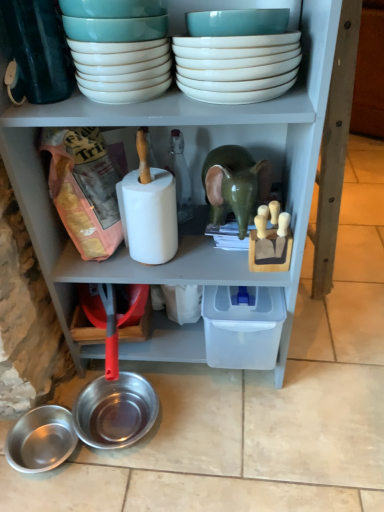
Question: Are shiny metallic bowl at lower left, arranged as the first bowl when ordered from the bottom, and white glossy bowls at upper center, the 2th bowl viewed from the top, making contact?

Choices:
 (A) no
 (B) yes

Answer: (A)

Question: Can you confirm if shiny metallic bowl at lower left, arranged as the first bowl when ordered from the bottom, is positioned to the right of white glossy bowls at upper center, the 2th bowl viewed from the top?

Choices:
 (A) no
 (B) yes

Answer: (A)

Question: From a real-world perspective, is shiny metallic bowl at lower left, arranged as the first bowl when ordered from the bottom, below white glossy bowls at upper center, the 2th bowl viewed from the top?

Choices:
 (A) yes
 (B) no

Answer: (A)

Question: Is shiny metallic bowl at lower left, arranged as the first bowl when ordered from the bottom, located outside white glossy bowls at upper center, placed as the 3th bowl when sorted from bottom to top?

Choices:
 (A) no
 (B) yes

Answer: (B)

Question: Does shiny metallic bowl at lower left, arranged as the first bowl when ordered from the bottom, lie in front of white glossy bowls at upper center, placed as the 3th bowl when sorted from bottom to top?

Choices:
 (A) yes
 (B) no

Answer: (B)

Question: Considering the positions of white glossy bowls at upper center, placed as the 3th bowl when sorted from bottom to top, and shiny metallic bowl at lower left, which ranks as the second bowl in bottom-to-top order, in the image, is white glossy bowls at upper center, placed as the 3th bowl when sorted from bottom to top, taller or shorter than shiny metallic bowl at lower left, which ranks as the second bowl in bottom-to-top order,?

Choices:
 (A) tall
 (B) short

Answer: (A)

Question: Considering the relative positions of white glossy bowls at upper center, the 2th bowl viewed from the top, and shiny metallic bowl at lower left, acting as the third bowl starting from the top, in the image provided, is white glossy bowls at upper center, the 2th bowl viewed from the top, to the left or to the right of shiny metallic bowl at lower left, acting as the third bowl starting from the top,?

Choices:
 (A) right
 (B) left

Answer: (A)

Question: Is white glossy bowls at upper center, placed as the 3th bowl when sorted from bottom to top, bigger or smaller than shiny metallic bowl at lower left, which ranks as the second bowl in bottom-to-top order?

Choices:
 (A) small
 (B) big

Answer: (A)

Question: Considering the positions of white glossy bowls at upper center, the 2th bowl viewed from the top, and shiny metallic bowl at lower left, which ranks as the second bowl in bottom-to-top order, in the image, is white glossy bowls at upper center, the 2th bowl viewed from the top, wider or thinner than shiny metallic bowl at lower left, which ranks as the second bowl in bottom-to-top order,?

Choices:
 (A) wide
 (B) thin

Answer: (B)

Question: Would you say white glossy bowls at upper center, which is counted as the 1th bowl, starting from the top, is to the left or to the right of shiny metallic bowl at lower left, arranged as the first bowl when ordered from the bottom, in the picture?

Choices:
 (A) left
 (B) right

Answer: (B)

Question: Choose the correct answer: Is white glossy bowls at upper center, which is counted as the 1th bowl, starting from the top, inside shiny metallic bowl at lower left, the fourth bowl viewed from the top, or outside it?

Choices:
 (A) inside
 (B) outside

Answer: (B)

Question: From a real-world perspective, relative to shiny metallic bowl at lower left, arranged as the first bowl when ordered from the bottom, is white glossy bowls at upper center, which is counted as the 1th bowl, starting from the top, vertically above or below?

Choices:
 (A) above
 (B) below

Answer: (A)

Question: Is point (185, 83) closer or farther from the camera than point (54, 435)?

Choices:
 (A) closer
 (B) farther

Answer: (A)

Question: From the image's perspective, is white glossy bowls at upper center, the 2th bowl viewed from the top, positioned above or below shiny metallic bowl at lower left, arranged as the first bowl when ordered from the bottom?

Choices:
 (A) below
 (B) above

Answer: (B)

Question: Is white glossy bowls at upper center, the 2th bowl viewed from the top, to the left or to the right of shiny metallic bowl at lower left, the fourth bowl viewed from the top, in the image?

Choices:
 (A) left
 (B) right

Answer: (B)